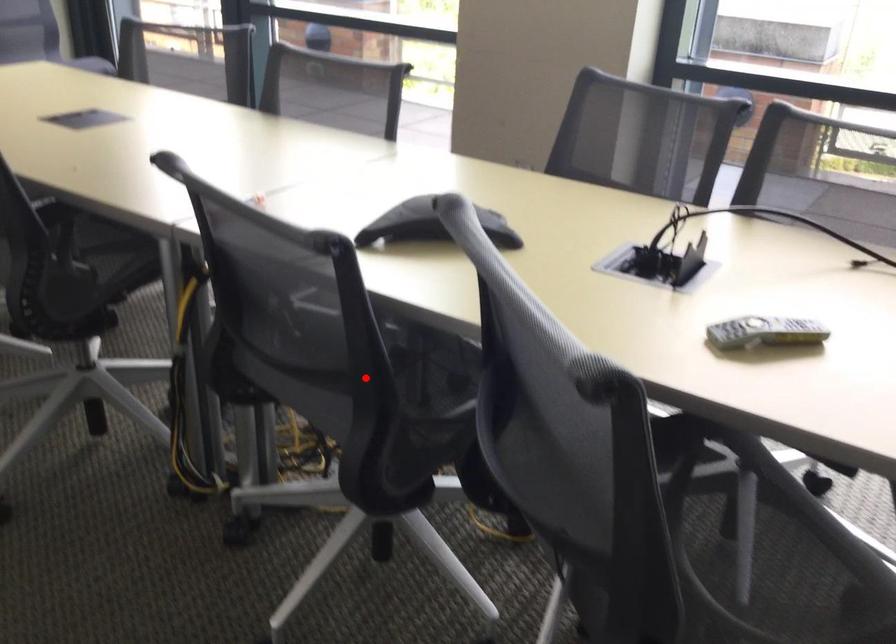
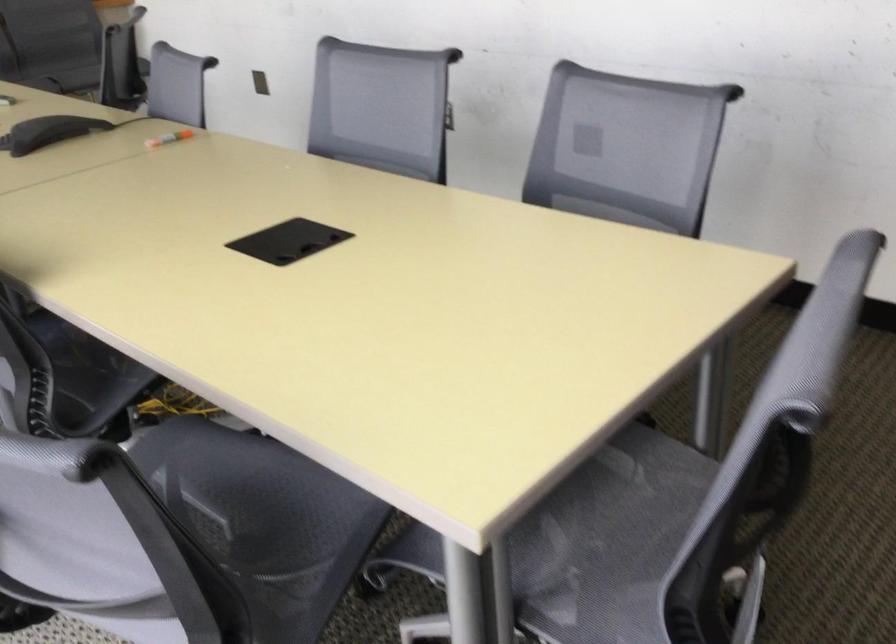
Question: I am providing you with two images of the same scene from different viewpoints. A red point is marked on the first image. Is the red point's position out of view in image 2?

Choices:
 (A) Yes
 (B) No

Answer: (A)